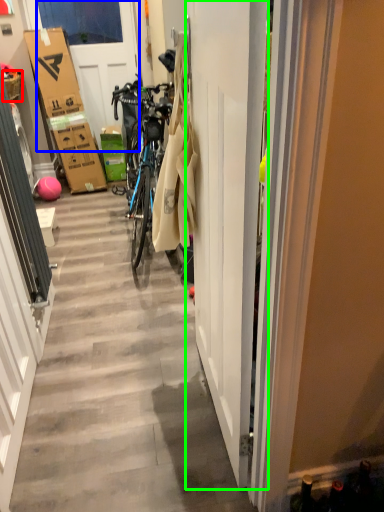
Question: Estimate the real-world distances between objects in this image. Which object is closer to picnic basket (highlighted by a red box), door (highlighted by a blue box) or door (highlighted by a green box)?

Choices:
 (A) door
 (B) door

Answer: (B)